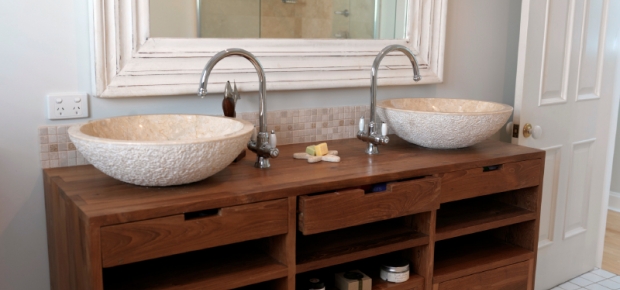
Find the location of a particular element. The height and width of the screenshot is (290, 620). light beige frame is located at coordinates (307, 65), (111, 23), (428, 17).